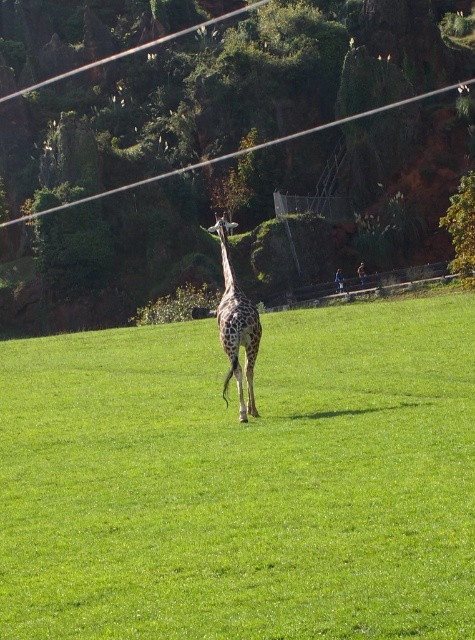
Based on the photo, you are a bird flying over the giraffe in the grassy field. You want to land on the transparent plastic power line at upper center or the green leafy tree at upper center. Which one is bigger and therefore safer to land on?

The transparent plastic power line at upper center is larger in size than the green leafy tree at upper center, so it is safer to land on the transparent plastic power line at upper center.

You are a photographer trying to capture a clear photo of the giraffe without any obstructions. There is a transparent plastic power line at upper center marked by point (x=238, y=152). Will this power line be visible in your photo?

The transparent plastic power line at upper center marked by point (x=238, y=152) is transparent, so it may not be clearly visible in the photo unless there is a contrasting background behind it.